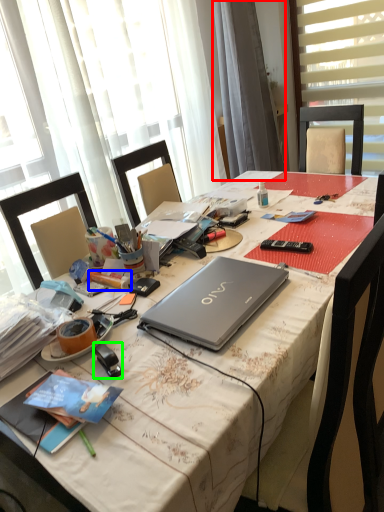
Question: Which object is positioned closest to curtain (highlighted by a red box)? Select from pencil (highlighted by a blue box) and stationery (highlighted by a green box).

Choices:
 (A) pencil
 (B) stationery

Answer: (A)